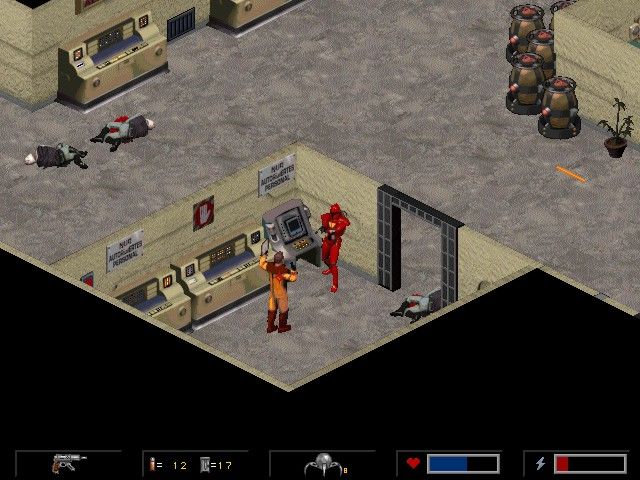
You are a GUI agent. You are given a task and a screenshot of the screen. Output one action in this format:
    pyautogui.click(x=<x>, y=<y>)
    Task: Click on the corner to another room on top left
    The image size is (640, 480).
    Given the screenshot: What is the action you would take?
    pyautogui.click(x=33, y=38)